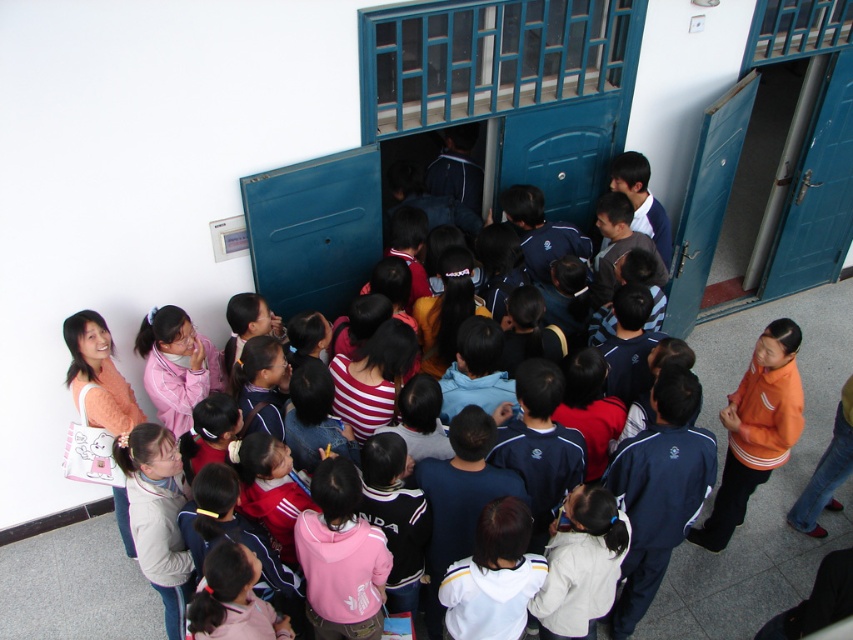
Question: Does blue painted wood door at right appear on the right side of pink fleece jacket at center?

Choices:
 (A) yes
 (B) no

Answer: (A)

Question: Which object is farther from the camera taking this photo?

Choices:
 (A) metallic blue door at center
 (B) pink fabric shirt at lower left
 (C) blue painted wood door at right
 (D) blue matte door at center

Answer: (C)

Question: Among these objects, which one is nearest to the camera?

Choices:
 (A) blue painted wood door at right
 (B) pink fabric shirt at lower left
 (C) white fleece jacket at center

Answer: (B)

Question: Which is farther from the orange fleece jacket at lower right?

Choices:
 (A) pink fleece jacket at center
 (B) white fleece jacket at center
 (C) navy blue tracksuit at center
 (D) blue matte door at center

Answer: (A)

Question: Does orange fleece jacket at lower right come in front of blue matte door at center?

Choices:
 (A) yes
 (B) no

Answer: (A)

Question: Does blue painted wood door at right lie in front of light beige jacket at center?

Choices:
 (A) no
 (B) yes

Answer: (A)